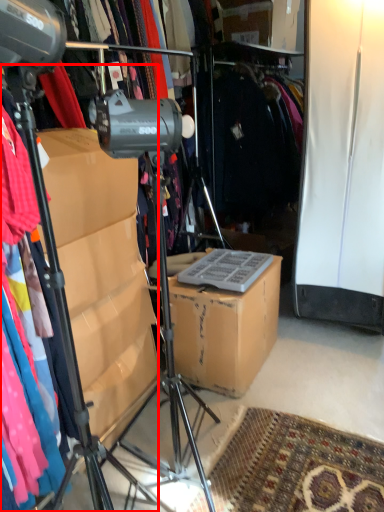
Question: From the image, what is the correct spatial relationship of tripod (annotated by the red box) in relation to cardboard box?

Choices:
 (A) right
 (B) left

Answer: (B)